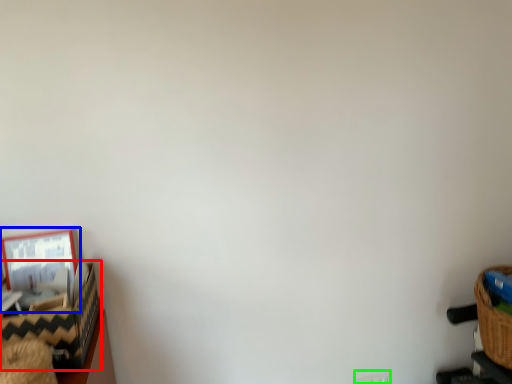
Question: Which is farther away from basket (highlighted by a red box)? picture frame (highlighted by a blue box) or electric outlet (highlighted by a green box)?

Choices:
 (A) picture frame
 (B) electric outlet

Answer: (B)